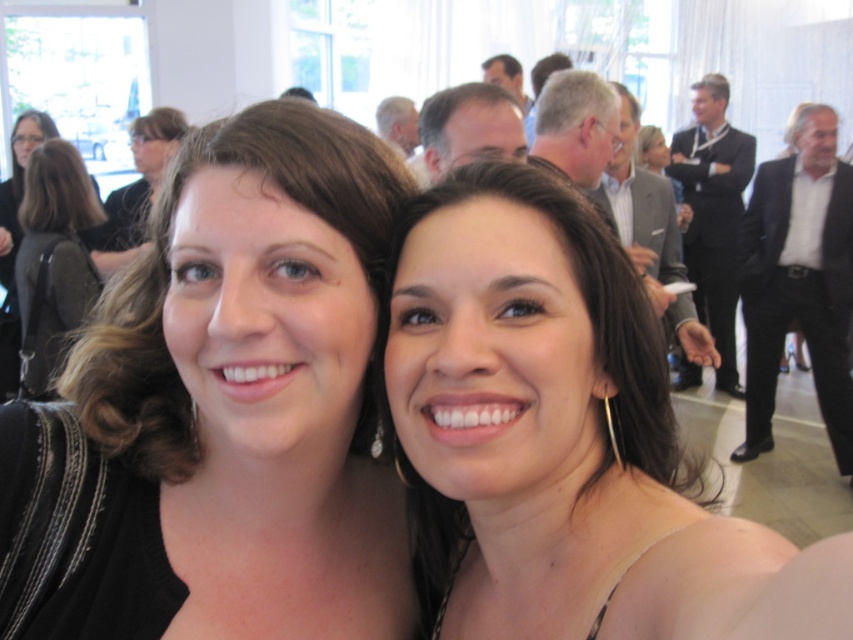
Identify the location of black suit at right. (799, 280).

Between black suit at right and black leather backpack at left, which one has more height?

black suit at right

What do you see at coordinates (799, 280) in the screenshot? The image size is (853, 640). I see `black suit at right` at bounding box center [799, 280].

What are the coordinates of `black suit at right` in the screenshot? It's located at point(799,280).

Is point (595, 577) positioned before point (834, 412)?

That is True.

Between point (421, 369) and point (815, 385), which one is positioned behind?

The point (815, 385) is behind.

Locate an element on the screen. The width and height of the screenshot is (853, 640). smooth skin face at center is located at coordinates (563, 436).

Is black fabric at center in front of smooth skin face at center?

That is False.

Between point (206, 298) and point (393, 268), which one is positioned behind?

The point (393, 268) is behind.

Image resolution: width=853 pixels, height=640 pixels. I want to click on black fabric at center, so coord(222,410).